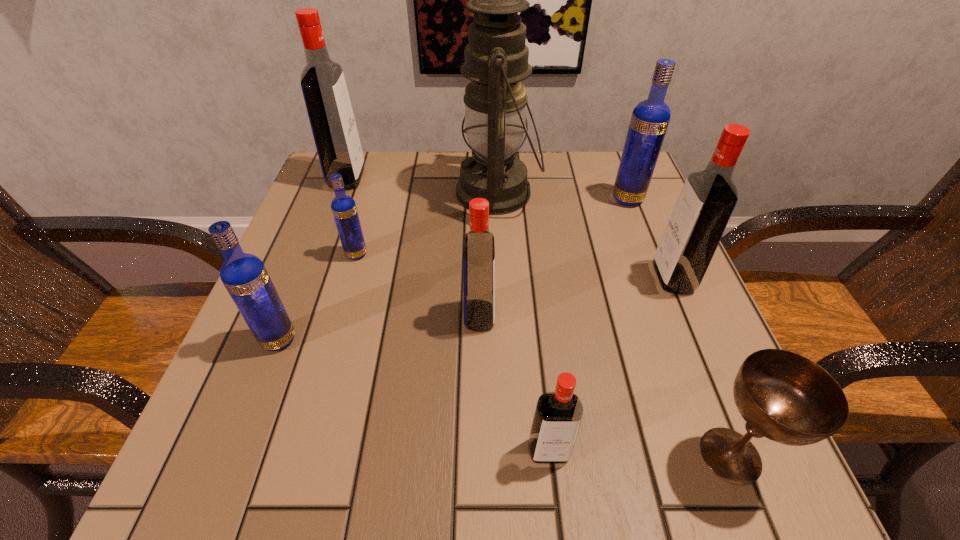
At what (x,y) coordinates should I click in order to perform the action: click on blank space that satisfies the following two spatial constraints: 1. on the back side of the second blue vodka from left to right; 2. on the left side of the oil lamp. Please return your answer as a coordinate pair (x, y). Looking at the image, I should click on (374, 192).

At what (x,y) coordinates should I click in order to perform the action: click on vacant space that satisfies the following two spatial constraints: 1. on the front and back of the tallest vodka; 2. on the back side of the oil lamp. Please return your answer as a coordinate pair (x, y). Image resolution: width=960 pixels, height=540 pixels. Looking at the image, I should click on (342, 192).